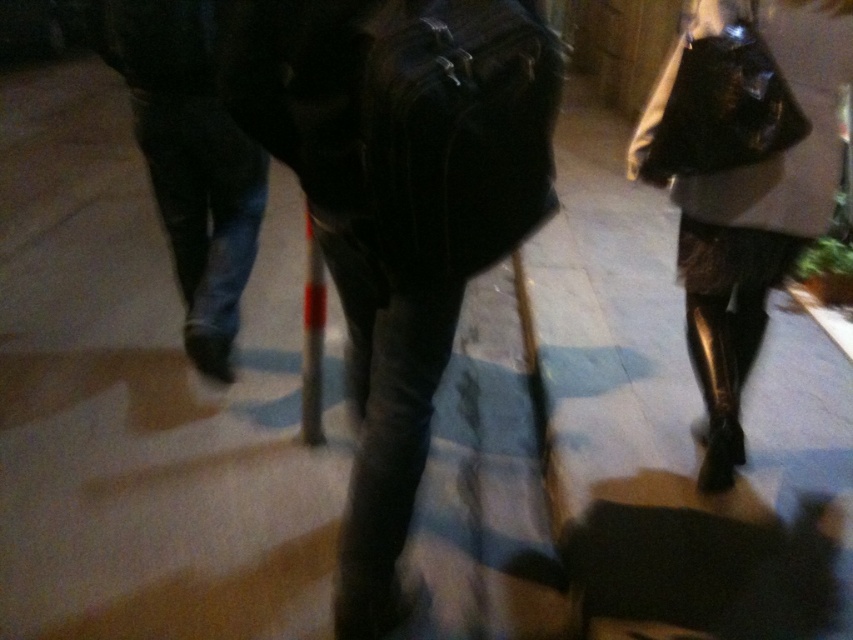
You are standing in the hallway and want to determine which of the two points, point (790, 246) or point (141, 122), is nearer to you. Based on the scene description, which point is closer?

Point (790, 246) is closer to the camera than point (141, 122), so it is the nearer one.

From the picture: You are standing in a hallway and see the shiny metallic boots at lower right and the dark denim jeans at left. Which object is positioned lower in the image?

The shiny metallic boots at lower right is positioned lower than the dark denim jeans at left.